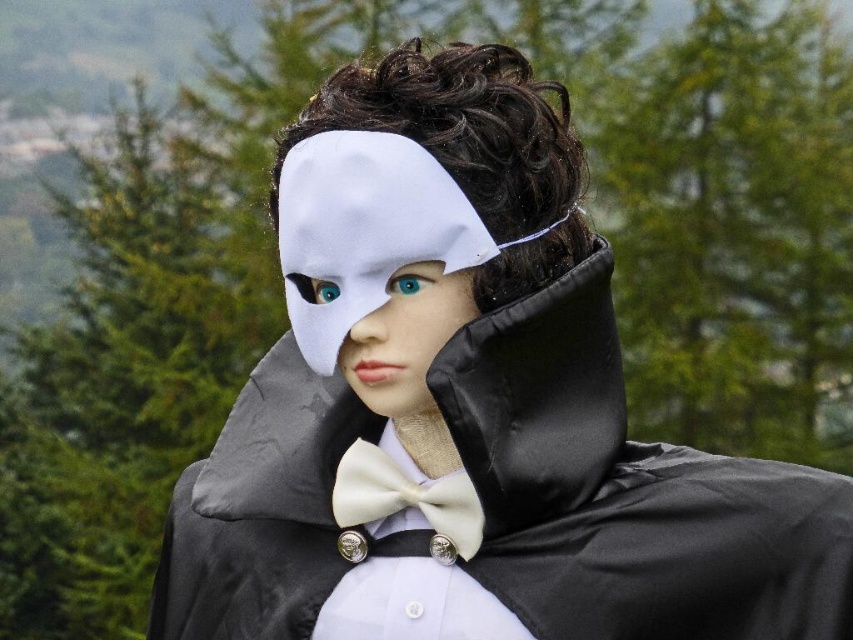
Based on the photo, you are a costume designer preparing for a play. You have two items on your desk, the white matte mask at center and the ivory satin bow tie at center. Which one takes up more space on the mannequin?

The white matte mask at center has a larger size compared to the ivory satin bow tie at center, so it takes up more space on the mannequin.

You are a costume designer preparing for a play. You need to adjust the placement of the white matte mask at center and the ivory satin bow tie at center so that the mask is centered on the mannequin. Which object should you move to the right?

The white matte mask at center is to the left of the ivory satin bow tie at center. To center the mask, you should move the ivory satin bow tie at center to the right so that the mask can be positioned in the middle.

Consider the image. You are a costume designer working on a play. You need to ensure that the white matte mask at center and the matte plastic eye at center are positioned correctly for the actor to see clearly. Given that the actor has average eye spacing, can the mask be placed as shown in the image?

The white matte mask at center is 7.00 centimeters away from the matte plastic eye at center. Since average human eye spacing is about 6.5 centimeters, the mask is positioned slightly farther apart than typical, which may affect the actor seeing clearly. Adjust the mask closer to the eye for better visibility.